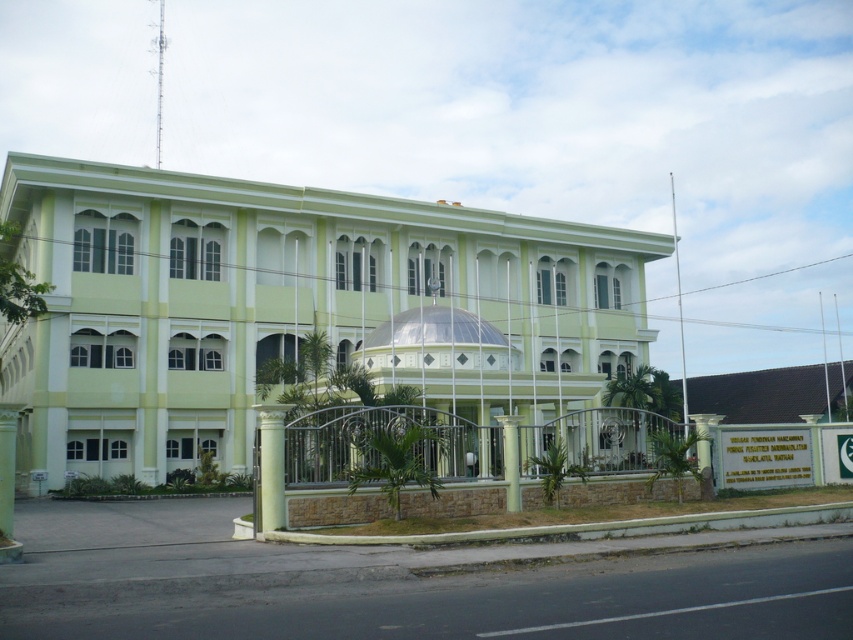
Question: Observing the image, what is the correct spatial positioning of green polished stone column at center in reference to white marble pillar at center?

Choices:
 (A) above
 (B) below

Answer: (A)

Question: Which is nearer to the green polished stone column at center?

Choices:
 (A) light green concrete building at center
 (B) white marble pillar at center

Answer: (B)

Question: Which of the following is the closest to the observer?

Choices:
 (A) (514, 477)
 (B) (276, 481)

Answer: (B)

Question: Does light green concrete building at center appear under white marble pillar at center?

Choices:
 (A) no
 (B) yes

Answer: (A)

Question: Is the position of green polished stone column at center more distant than that of white marble pillar at center?

Choices:
 (A) yes
 (B) no

Answer: (B)

Question: Which object is the farthest from the light green concrete building at center?

Choices:
 (A) green polished stone column at center
 (B) white marble pillar at center

Answer: (A)